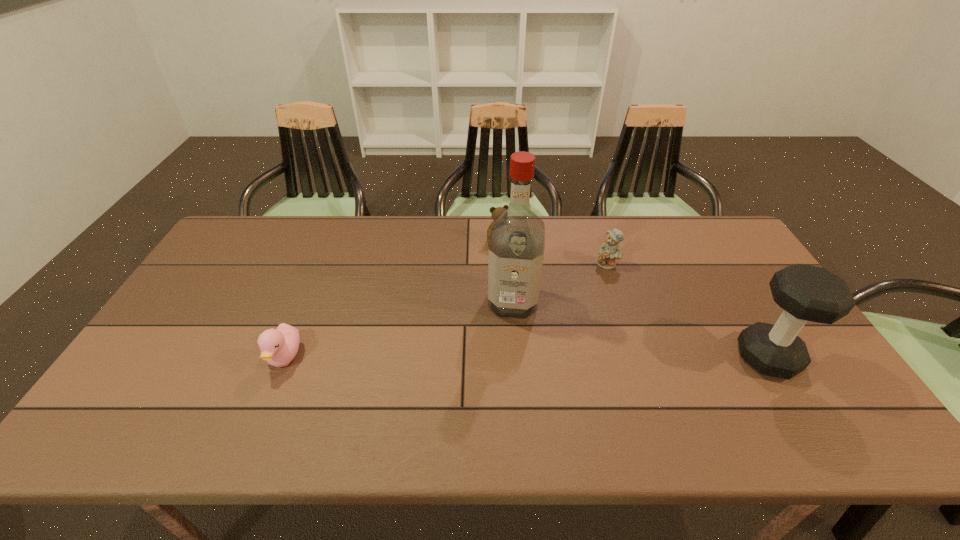
Find the location of a particular element. The width and height of the screenshot is (960, 540). the fourth closest object to the second object from right to left is located at coordinates (279, 346).

Locate an element on the screen. The image size is (960, 540). free spot that satisfies the following two spatial constraints: 1. on the front side of the tallest object; 2. on the left side of the rightmost object is located at coordinates (517, 357).

Find the location of a particular element. free spot that satisfies the following two spatial constraints: 1. on the back side of the fourth nearest object; 2. on the left side of the tallest object is located at coordinates (510, 265).

This screenshot has height=540, width=960. What are the coordinates of `vacant space that satisfies the following two spatial constraints: 1. on the front-facing side of the dumbbell; 2. on the right side of the duckling` in the screenshot? It's located at (285, 357).